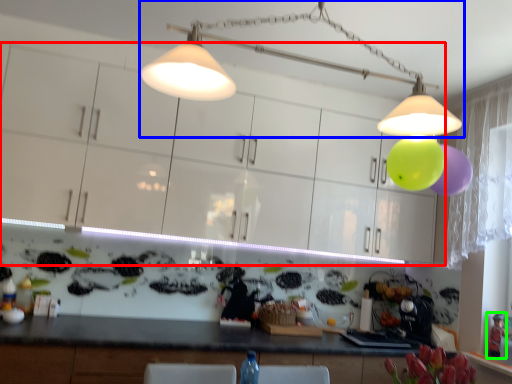
Question: Which is farther away from cabinetry (highlighted by a red box)? lamp (highlighted by a blue box) or toy (highlighted by a green box)?

Choices:
 (A) lamp
 (B) toy

Answer: (B)